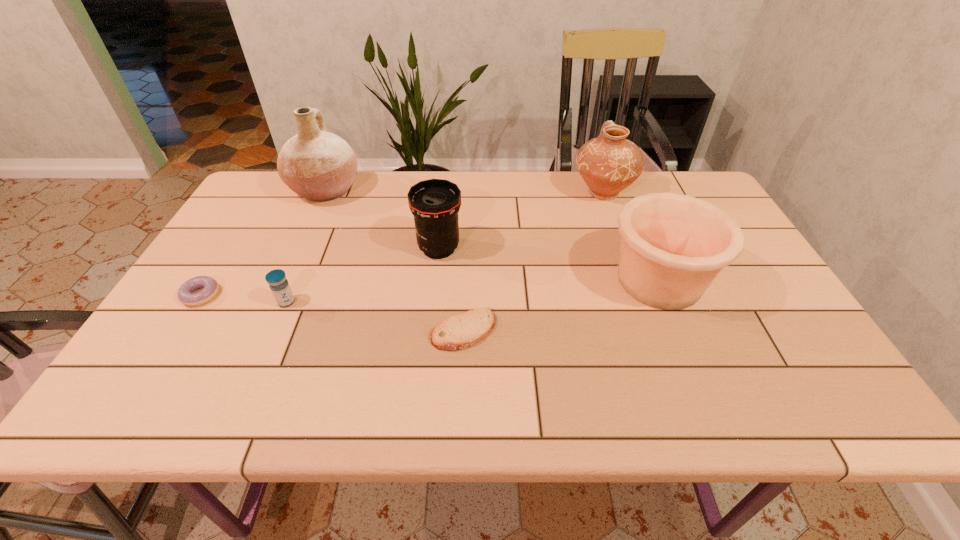
At what (x,y) coordinates should I click in order to perform the action: click on vacant space at the left edge of the desktop. Please return your answer as a coordinate pair (x, y). The image size is (960, 540). Looking at the image, I should click on click(180, 361).

In the image, there is a desktop. Where is `vacant area at the right edge`? The height and width of the screenshot is (540, 960). vacant area at the right edge is located at coordinates (783, 320).

At what (x,y) coordinates should I click in order to perform the action: click on blank space at the far left corner of the desktop. Please return your answer as a coordinate pair (x, y). Looking at the image, I should click on pyautogui.click(x=279, y=197).

Find the location of a particular element. free spot at the far right corner of the desktop is located at coordinates (688, 185).

The width and height of the screenshot is (960, 540). In order to click on free space between the tallest pottery and the nearest pottery in this screenshot , I will do `click(492, 235)`.

The height and width of the screenshot is (540, 960). In order to click on free space between the leftmost object and the shortest pottery in this screenshot , I will do `click(430, 288)`.

Where is `unoccupied position between the shortest pottery and the leftmost object`? unoccupied position between the shortest pottery and the leftmost object is located at coordinates (430, 288).

Find the location of a particular element. vacant area that lies between the shortest object and the tallest object is located at coordinates (395, 260).

Locate an element on the screen. This screenshot has height=540, width=960. free point between the leftmost object and the nearest pottery is located at coordinates (430, 288).

Find the location of `empty space between the telephoto lens and the leftmost pottery`. empty space between the telephoto lens and the leftmost pottery is located at coordinates (382, 219).